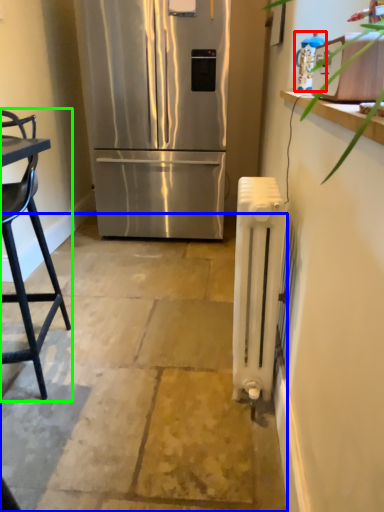
Question: Based on their relative distances, which object is farther from appliance (highlighted by a red box)? Choose from concrete (highlighted by a blue box) and chair (highlighted by a green box).

Choices:
 (A) concrete
 (B) chair

Answer: (A)